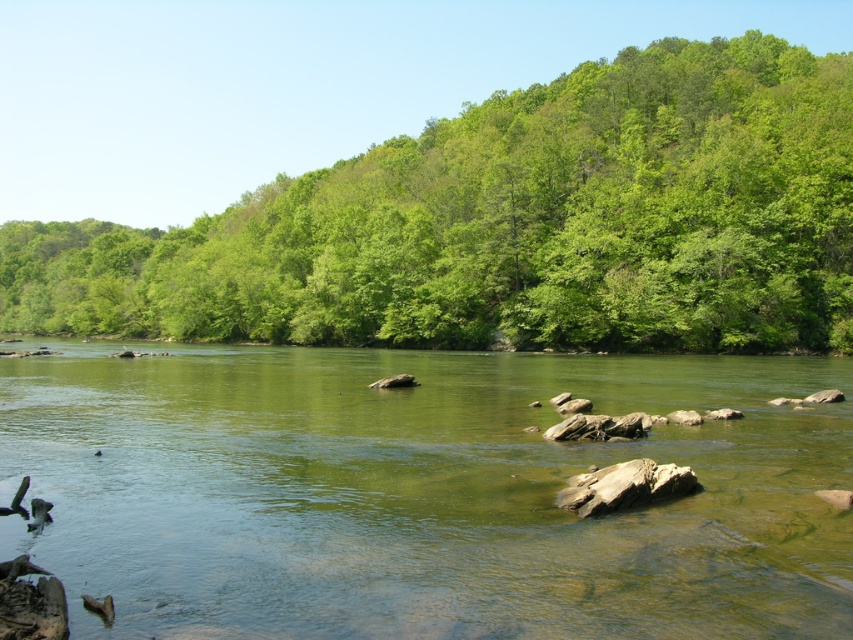
Question: Is green translucent water at center smaller than green leafy trees at upper center?

Choices:
 (A) no
 (B) yes

Answer: (B)

Question: Which point is closer to the camera taking this photo?

Choices:
 (A) (120, 266)
 (B) (397, 592)

Answer: (B)

Question: Can you confirm if green translucent water at center is positioned to the left of green leafy trees at upper center?

Choices:
 (A) yes
 (B) no

Answer: (B)

Question: Can you confirm if green translucent water at center is bigger than green leafy trees at upper center?

Choices:
 (A) no
 (B) yes

Answer: (A)